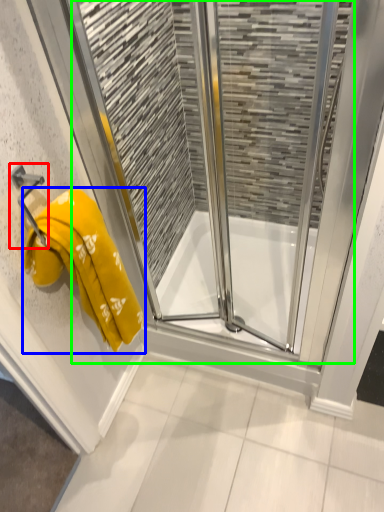
Question: Which object is the closest to the towel bar (highlighted by a red box)? Choose among these: towel (highlighted by a blue box) or screen door (highlighted by a green box).

Choices:
 (A) towel
 (B) screen door

Answer: (A)